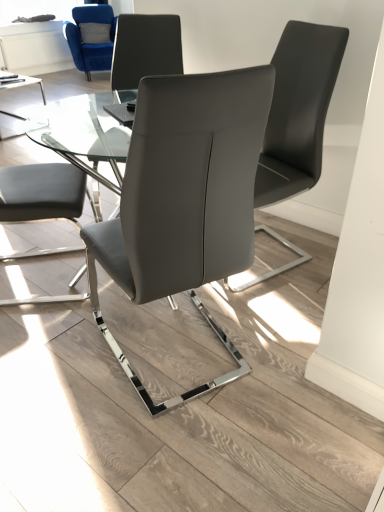
This screenshot has width=384, height=512. In order to click on free space on the front side of matte gray chair at center, the fourth chair from the top in this screenshot , I will do `click(175, 445)`.